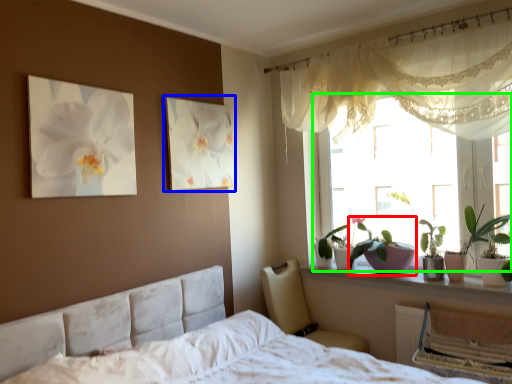
Question: Which is nearer to the plant (highlighted by a red box)? picture frame (highlighted by a blue box) or window (highlighted by a green box).

Choices:
 (A) picture frame
 (B) window

Answer: (B)